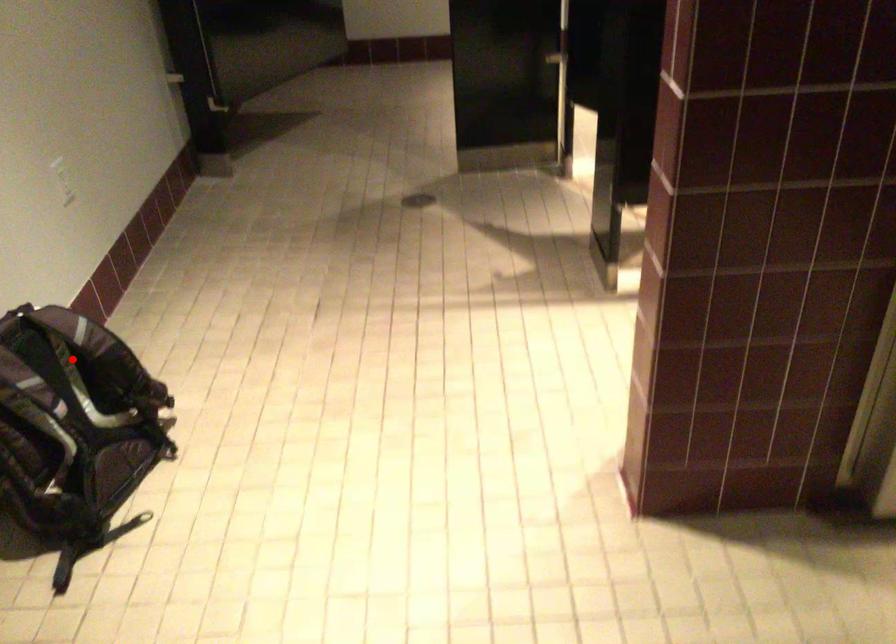
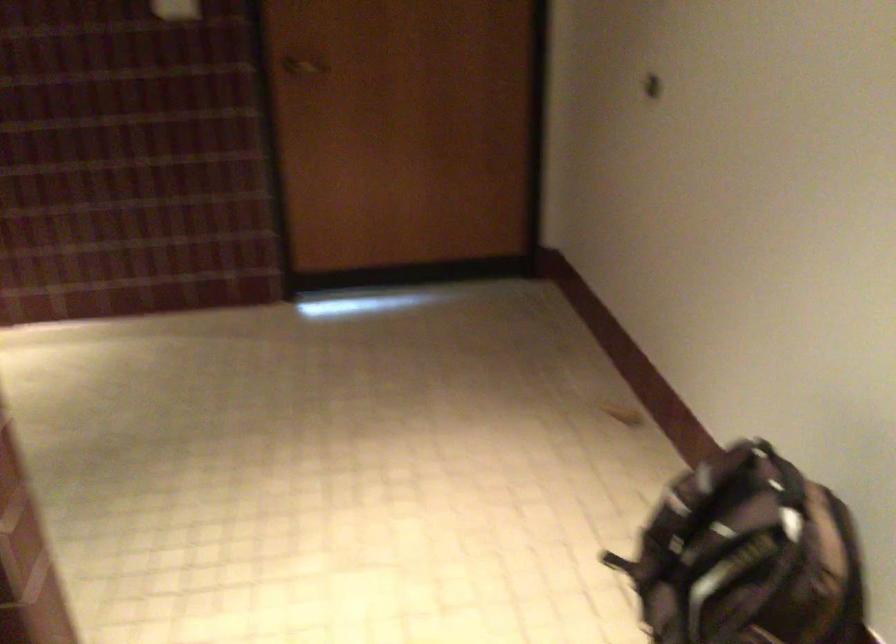
Question: I am providing you with two images of the same scene from different viewpoints. Given a red point in image1, look at the same physical point in image2. Is it:

Choices:
 (A) Closer to the viewpoint
 (B) Farther from the viewpoint

Answer: (A)